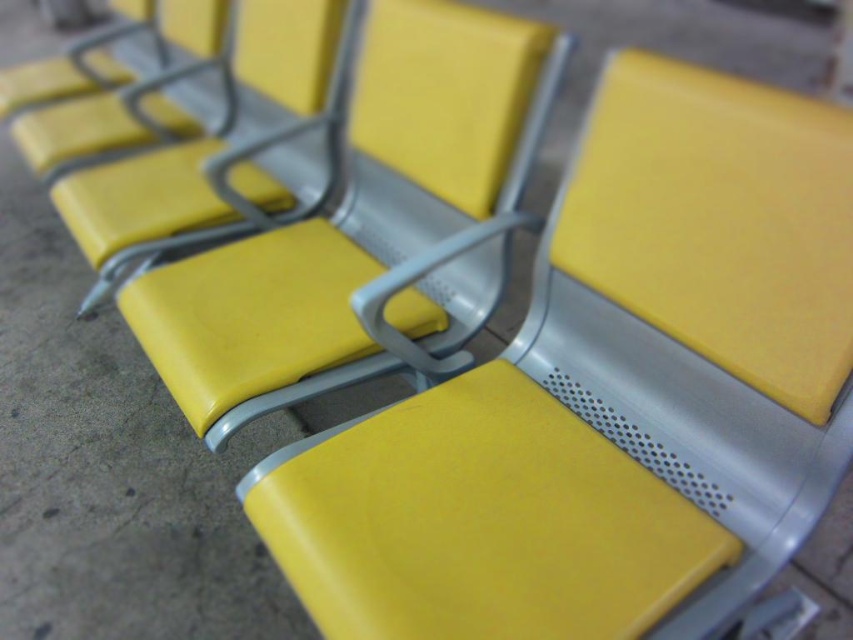
You are standing in front of two yellow seats. The first is labeled as the yellow matte seat at center, and the second is the matte yellow seat at center. Which one is positioned to the right?

The yellow matte seat at center is positioned to the right of the matte yellow seat at center.

You are standing in a waiting area with a row of yellow seats. There is a specific point at coordinates (x=610, y=396). Which object does this point correspond to?

The point at coordinates (x=610, y=396) corresponds to the yellow matte seat at center.

You are a maintenance worker inspecting seats in a public area. You notice two seats, the yellow matte seat at center and the matte yellow seat at upper left. Which one requires more material to repair its cushion if they both need the same thickness of foam?

The yellow matte seat at center requires more material to repair its cushion because it is larger in size than the matte yellow seat at upper left.